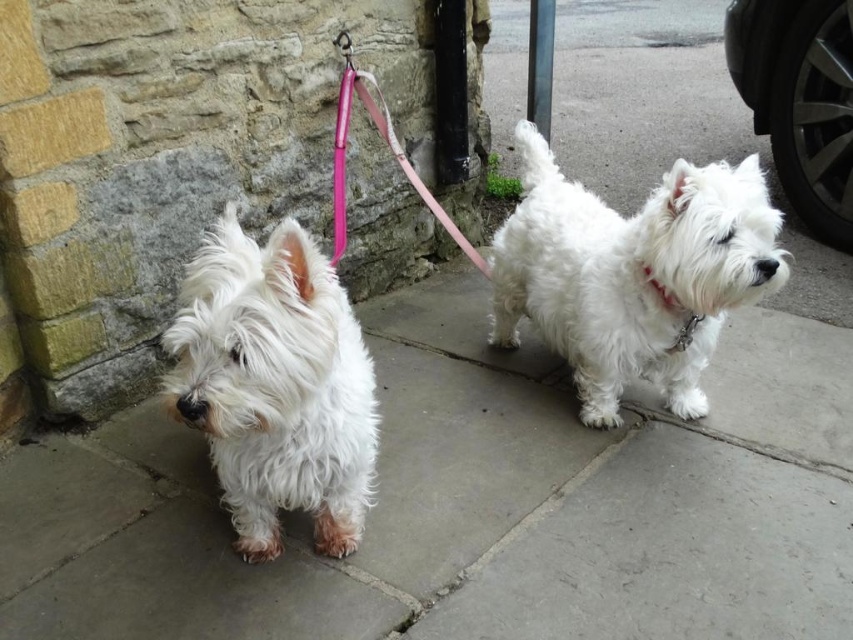
You are a photographer positioned at the origin point of the image. The white fluffy dog at center is at coordinates 0.428, 0.742. If you want to frame the dog in your shot, which direction should you move your camera? Please specify the direction based on the coordinate system where the origin is the bottom left corner of the image, with the x and y axes increasing to the right and upwards respectively.

The white fluffy dog at center is located at coordinates (x=631, y=273). Since the origin is at the bottom left, moving the camera to the right would increase the x coordinate and moving upwards would increase the y coordinate. To frame the dog, you should move the camera to the right and upwards to align with the dog at (x=631, y=273).

You are a dog owner trying to secure both your dogs. You have a pink fabric leash at center and a white fabric neckband at center right. Which item can you use to tie the dogs to the stone wall?

The pink fabric leash at center has a larger size compared to the white fabric neckband at center right, so it is more suitable for tying the dogs to the stone wall.